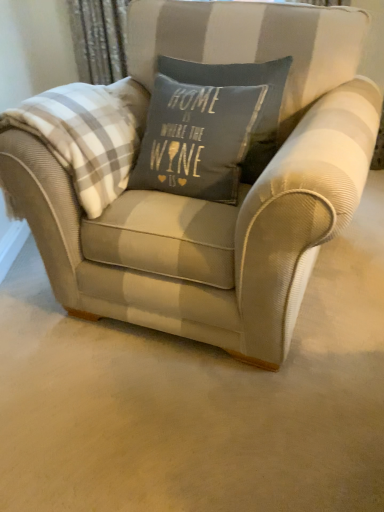
Question: Looking at the image, does textured beige armchair at center seem bigger or smaller compared to white plaid blanket at left?

Choices:
 (A) big
 (B) small

Answer: (A)

Question: Is textured beige armchair at center wider or thinner than white plaid blanket at left?

Choices:
 (A) wide
 (B) thin

Answer: (A)

Question: Is textured beige armchair at center in front of or behind white plaid blanket at left in the image?

Choices:
 (A) front
 (B) behind

Answer: (A)

Question: From a real-world perspective, relative to textured beige armchair at center, is white plaid blanket at left vertically above or below?

Choices:
 (A) above
 (B) below

Answer: (A)

Question: Considering the positions of point (104, 111) and point (332, 37), is point (104, 111) closer or farther from the camera than point (332, 37)?

Choices:
 (A) farther
 (B) closer

Answer: (B)

Question: Considering their positions, is white plaid blanket at left located in front of or behind textured beige armchair at center?

Choices:
 (A) front
 (B) behind

Answer: (B)

Question: Considering the positions of white plaid blanket at left and textured beige armchair at center in the image, is white plaid blanket at left bigger or smaller than textured beige armchair at center?

Choices:
 (A) big
 (B) small

Answer: (B)